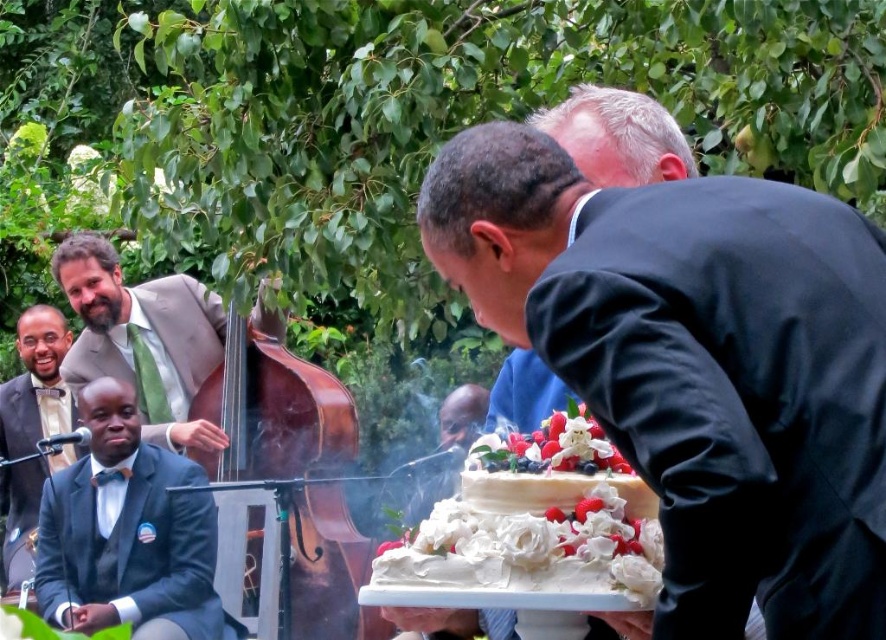
You are a photographer at the event and want to capture a closeup of the matte black suit at lower left and the matte green bow tie at left. Which one is nearer to you?

The matte black suit at lower left is closer to the viewer than the matte green bow tie at left.

You are standing at point (128, 532) in the image. What color is the suit of the person closest to you?

The person closest to you at point (128, 532) is wearing a matte black suit.